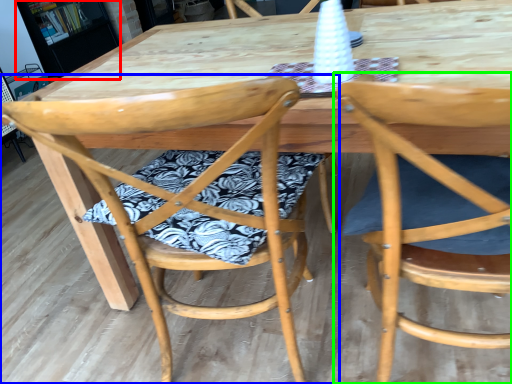
Question: Which object is positioned closest to bookshelf (highlighted by a red box)? Select from chair (highlighted by a blue box) and chair (highlighted by a green box).

Choices:
 (A) chair
 (B) chair

Answer: (A)